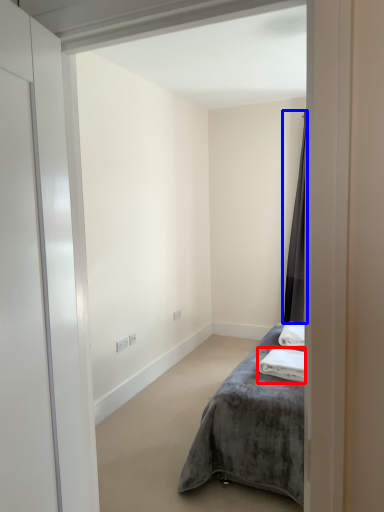
Question: Among these objects, which one is nearest to the camera, bath towel (highlighted by a red box) or curtain (highlighted by a blue box)?

Choices:
 (A) bath towel
 (B) curtain

Answer: (A)